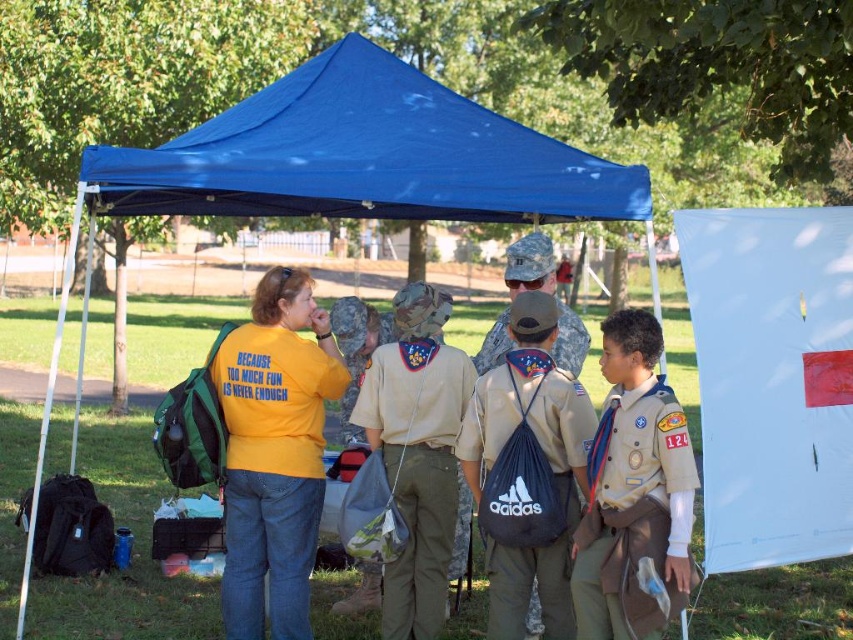
Question: Among these objects, which one is farthest from the camera?

Choices:
 (A) dark blue synthetic backpack at center
 (B) brown canvas uniform at center

Answer: (A)

Question: Which of these objects is positioned farthest from the brown canvas uniform at center?

Choices:
 (A) yellow cotton shirt at center
 (B) blue fabric canopy at upper center
 (C) dark blue synthetic backpack at center
 (D) blue fabric tent at center

Answer: (D)

Question: Is blue fabric canopy at upper center below dark blue synthetic backpack at center?

Choices:
 (A) no
 (B) yes

Answer: (A)

Question: Does blue fabric tent at center have a larger size compared to brown canvas uniform at center?

Choices:
 (A) yes
 (B) no

Answer: (A)

Question: Estimate the real-world distances between objects in this image. Which object is farther from the blue fabric tent at center?

Choices:
 (A) dark blue synthetic backpack at center
 (B) brown canvas uniform at center

Answer: (A)

Question: Does blue fabric tent at center appear on the right side of dark blue synthetic backpack at center?

Choices:
 (A) no
 (B) yes

Answer: (A)